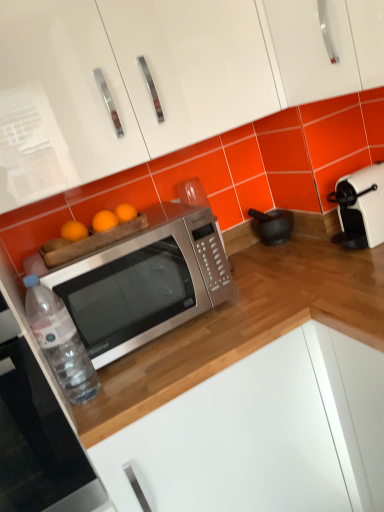
Question: Is clear plastic bottle at lower left to the left or to the right of brushed metal microwave at lower left in the image?

Choices:
 (A) right
 (B) left

Answer: (A)

Question: Which is correct: clear plastic bottle at lower left is inside brushed metal microwave at lower left, or outside of it?

Choices:
 (A) outside
 (B) inside

Answer: (A)

Question: Which is nearer to the satin silver microwave at center?

Choices:
 (A) white glossy cabinet at upper center, acting as the 2th cabinetry starting from the bottom
 (B) brushed metal microwave at lower left
 (C) white plastic toaster at right
 (D) white glossy cabinet at lower center, the first cabinetry ordered from the bottom
 (E) clear plastic bottle at lower left

Answer: (E)

Question: Estimate the real-world distances between objects in this image. Which object is closer to the white glossy cabinet at upper center, acting as the 2th cabinetry starting from the bottom?

Choices:
 (A) clear plastic bottle at lower left
 (B) white glossy cabinet at lower center, the first cabinetry ordered from the bottom
 (C) white plastic toaster at right
 (D) satin silver microwave at center
 (E) brushed metal microwave at lower left

Answer: (D)